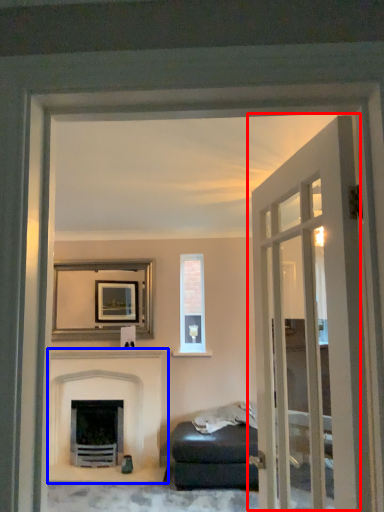
Question: Among these objects, which one is farthest to the camera, door (highlighted by a red box) or fireplace (highlighted by a blue box)?

Choices:
 (A) door
 (B) fireplace

Answer: (B)